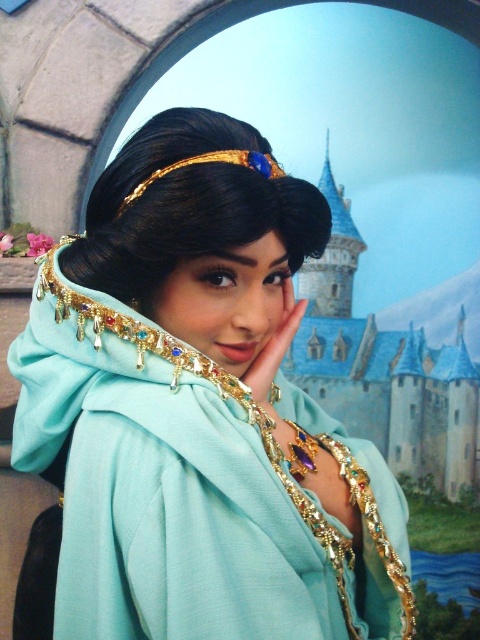
Consider the image. Is matte teal fabric at center closer to the viewer compared to shiny gold headband at center?

That is True.

Does point (81, 593) come farther from viewer compared to point (151, 234)?

No.

Locate an element on the screen. This screenshot has width=480, height=640. matte teal fabric at center is located at coordinates (200, 410).

Does matte teal fabric at center have a larger size compared to gold metallic tiara at upper center?

Correct, matte teal fabric at center is larger in size than gold metallic tiara at upper center.

Does matte teal fabric at center have a lesser width compared to gold metallic tiara at upper center?

In fact, matte teal fabric at center might be wider than gold metallic tiara at upper center.

Who is more forward, (81,381) or (267,168)?

Point (81,381) is more forward.

What are the coordinates of `matte teal fabric at center` in the screenshot? It's located at (200, 410).

Between shiny gold headband at center and gold metallic tiara at upper center, which one has less height?

Standing shorter between the two is gold metallic tiara at upper center.

Does shiny gold headband at center have a greater width compared to gold metallic tiara at upper center?

Indeed, shiny gold headband at center has a greater width compared to gold metallic tiara at upper center.

Does point (99, 230) lie behind point (168, 172)?

Yes, point (99, 230) is behind point (168, 172).

The image size is (480, 640). I want to click on shiny gold headband at center, so click(x=189, y=204).